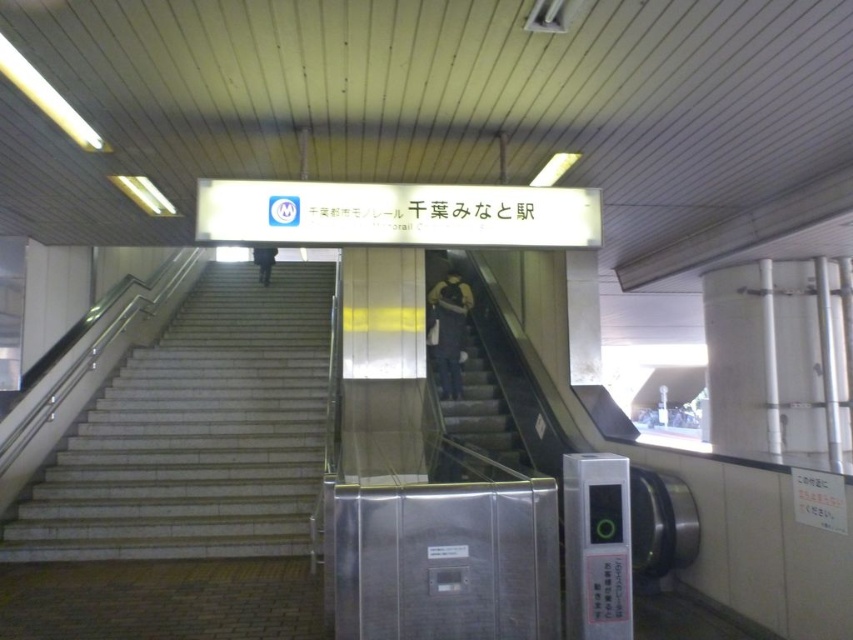
You are a maintenance worker needing to inspect a camera located near the entrance of Chiba Minato Station. The camera is positioned above the gray concrete stairs at center. Given that your ladder can extend up to 6 meters, can you safely reach the camera using the ladder?

The gray concrete stairs at center and camera are 6.67 meters apart from each other. Since the ladder can only extend up to 6 meters, it is not long enough to safely reach the camera.

You are a person with a heavy suitcase. You need to choose between the white marble stairs at center and the gray concrete stairs at center to reach the platform. Which stairs should you choose if you want to carry your luggage more easily?

The gray concrete stairs at center is larger in size compared to the white marble stairs at center, so it would be easier to carry your luggage on the gray concrete stairs at center.